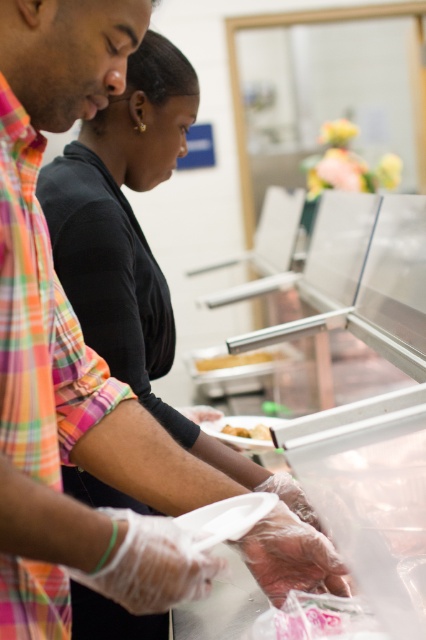
Looking at this image, you are a new employee at the food service area and need to retrieve the yellow matte bread at center to prepare a sandwich. The yellow matte tray at center is blocking your access. Can you reach the bread without moving the tray?

The yellow matte bread at center is behind the yellow matte tray at center, so you can reach it by moving around the tray or lifting the tray if possible to access the bread without disturbing other items.

You are organizing a food station and need to place the yellow matte tray at center and the yellow matte bread at center correctly. According to the spatial arrangement, which object is placed above the other?

The yellow matte tray at center is positioned over the yellow matte bread at center, so the tray is above the bread.